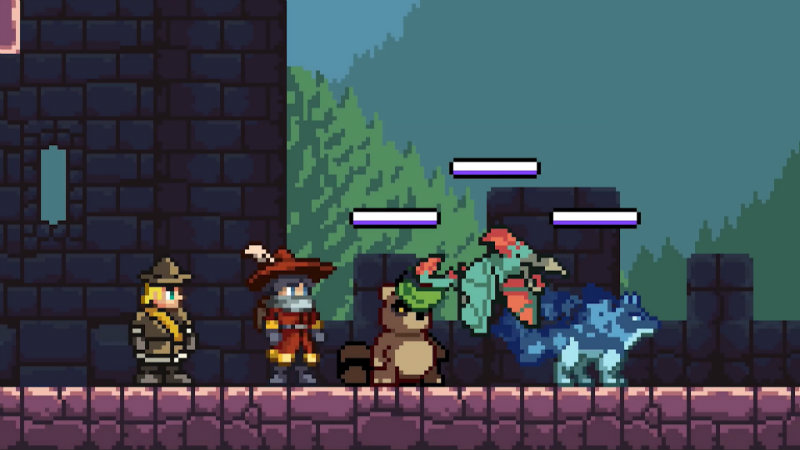
Locate an element on the screen. The image size is (800, 450). walls is located at coordinates [205, 106], [373, 271], [530, 220], [724, 279].